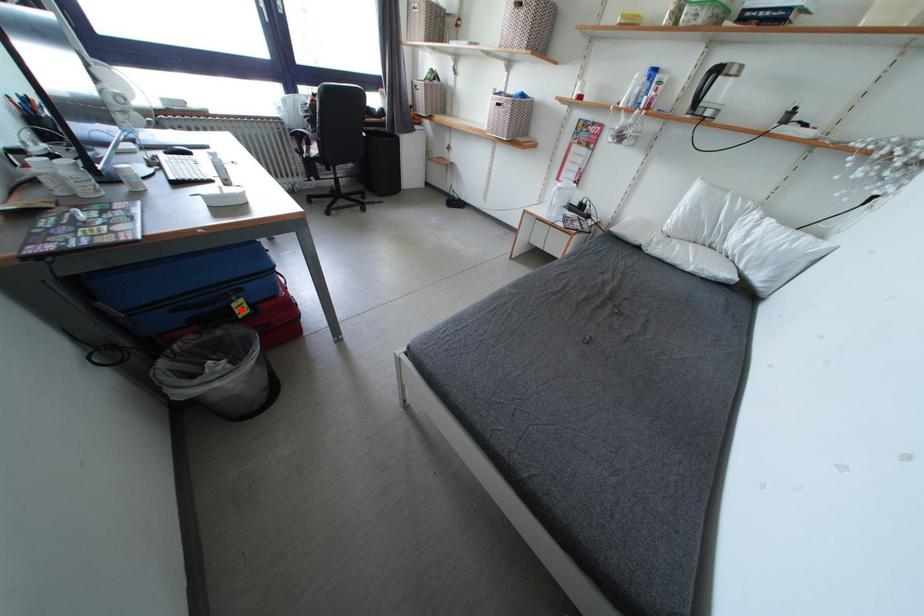
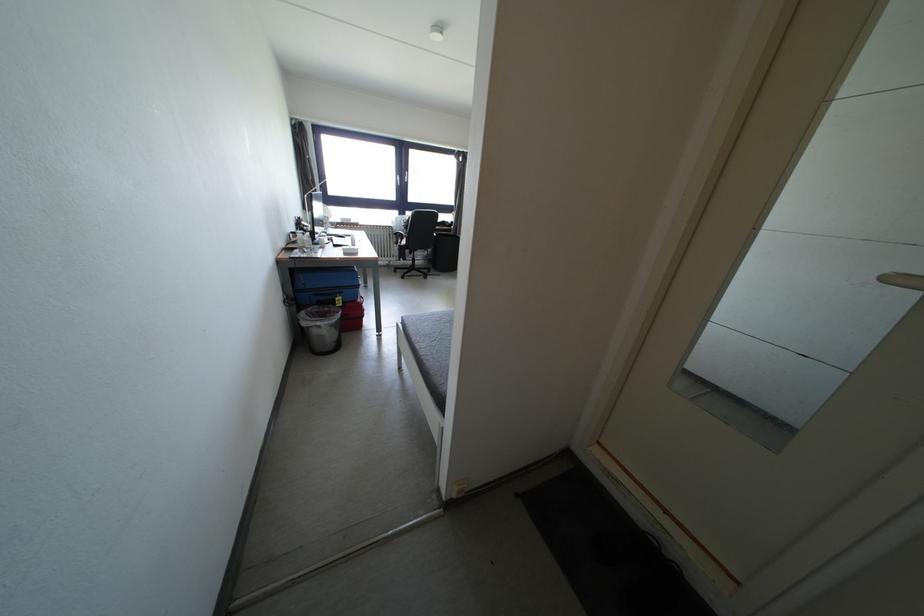
Question: I am providing you with two images of the same scene from different viewpoints. A red point is marked on the first image. At the location where the point appears in image 1, is it still visible in image 2?

Choices:
 (A) Yes
 (B) No

Answer: (A)